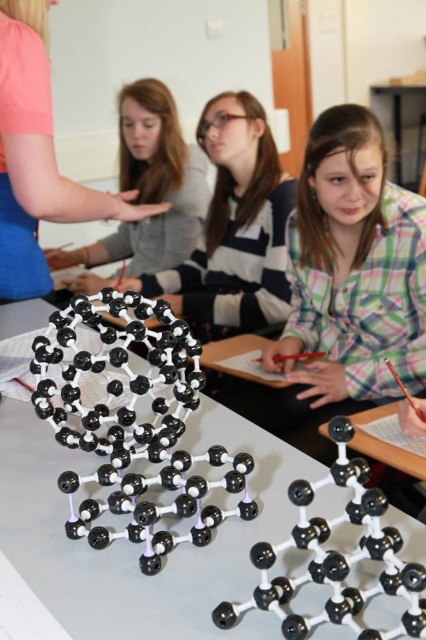
Does matte black hair at upper center have a smaller size compared to black plastic table at center?

Incorrect, matte black hair at upper center is not smaller in size than black plastic table at center.

Between matte black hair at upper center and black plastic table at center, which one appears on the right side from the viewer's perspective?

black plastic table at center

What are the coordinates of `matte black hair at upper center` in the screenshot? It's located at (149, 186).

Does pink fabric at upper left lie behind matte black hair at upper center?

That is False.

How much distance is there between pink fabric at upper left and matte black hair at upper center?

pink fabric at upper left and matte black hair at upper center are 3.57 feet apart from each other.

Between point (17, 257) and point (92, 243), which one is positioned in front?

Point (17, 257) is in front.

The image size is (426, 640). In order to click on pink fabric at upper left in this screenshot , I will do `click(37, 157)`.

Image resolution: width=426 pixels, height=640 pixels. What do you see at coordinates (353, 268) in the screenshot?
I see `green plaid shirt at center` at bounding box center [353, 268].

Identify the location of green plaid shirt at center. (353, 268).